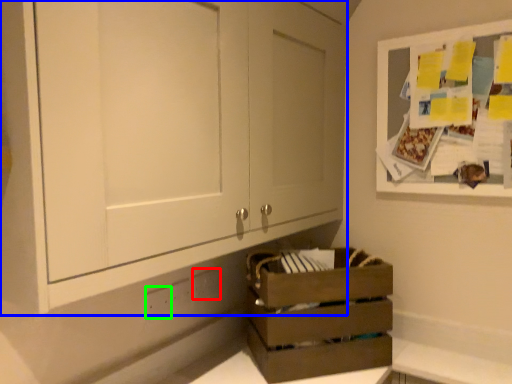
Question: Based on their relative distances, which object is farther from electric outlet (highlighted by a red box)? Choose from cabinetry (highlighted by a blue box) and electric outlet (highlighted by a green box).

Choices:
 (A) cabinetry
 (B) electric outlet

Answer: (A)